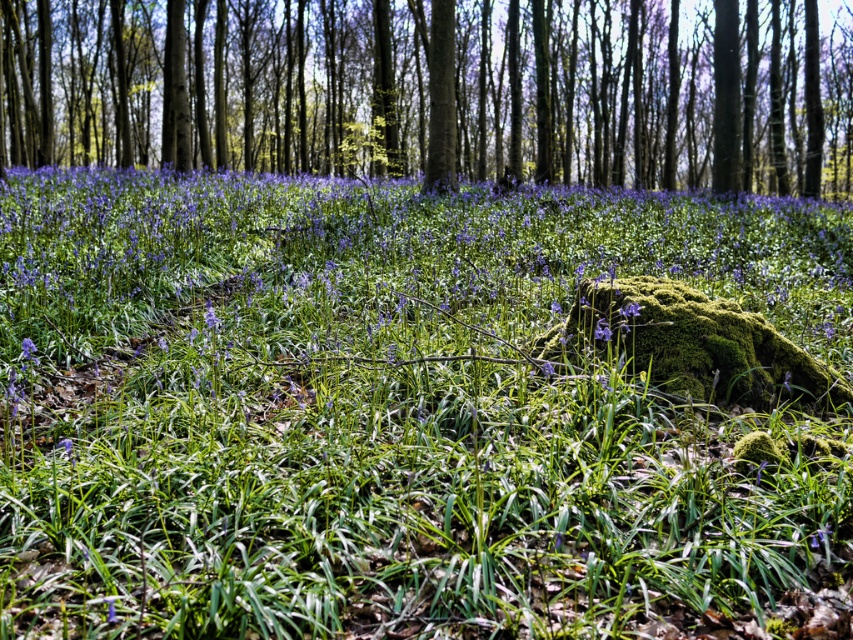
Question: Which object is positioned closest to the green mossy rock at center?

Choices:
 (A) purple matte flower at center-right
 (B) purple matte flower at center
 (C) purple matte flower at lower left
 (D) green mossy rock at center-right

Answer: (D)

Question: Which point appears closest to the camera in this image?

Choices:
 (A) (653, 288)
 (B) (773, 100)
 (C) (624, 308)

Answer: (C)

Question: Which of the following is the farthest from the observer?

Choices:
 (A) green mossy rock at center-right
 (B) purple matte flower at center
 (C) green grass at center

Answer: (A)

Question: Can you confirm if green mossy rock at center is positioned to the right of purple matte flower at lower left?

Choices:
 (A) no
 (B) yes

Answer: (B)

Question: Is green mossy rock at center smaller than purple matte flower at center?

Choices:
 (A) yes
 (B) no

Answer: (B)

Question: Is green grass at center smaller than purple matte flower at center?

Choices:
 (A) yes
 (B) no

Answer: (B)